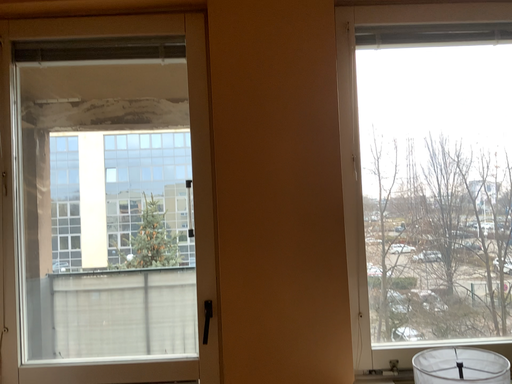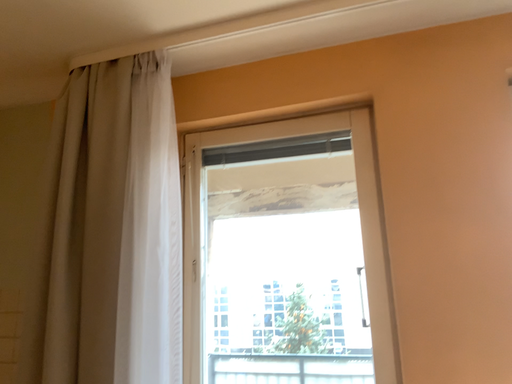
Question: How did the camera likely rotate when shooting the video?

Choices:
 (A) rotated right
 (B) rotated left

Answer: (B)